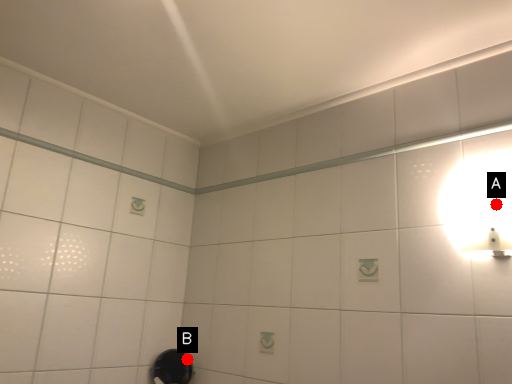
Question: Two points are circled on the image, labeled by A and B beside each circle. Which point is closer to the camera?

Choices:
 (A) A is closer
 (B) B is closer

Answer: (A)